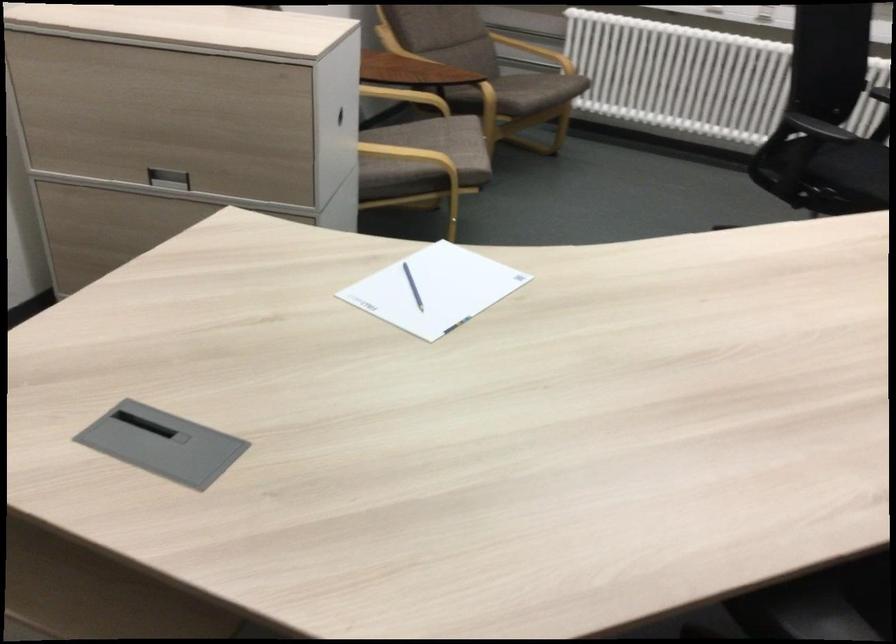
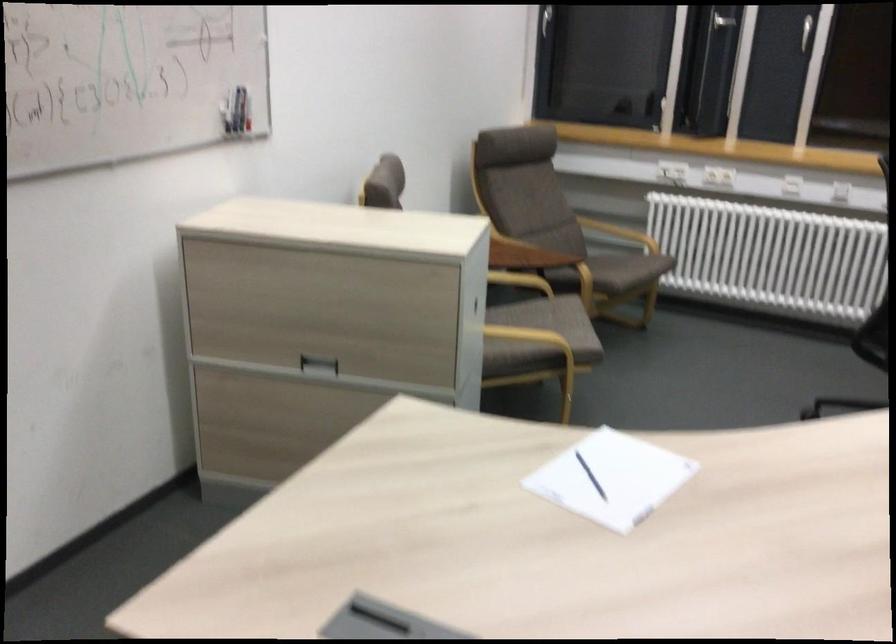
Locate, in the second image, the point that corresponds to (521,93) in the first image.

(618, 270)